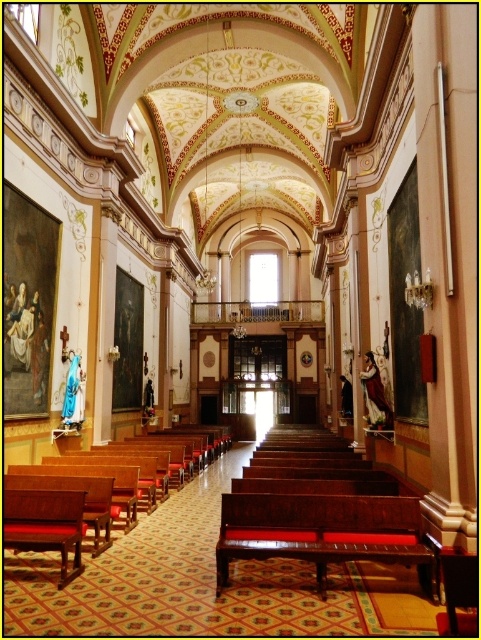
Which of these two, mahogany wood bench at center or wooden polished bench at center, stands shorter?

mahogany wood bench at center is shorter.

Which is above, mahogany wood bench at center or wooden polished bench at center?

mahogany wood bench at center is above.

Locate an element on the screen. mahogany wood bench at center is located at coordinates (323, 532).